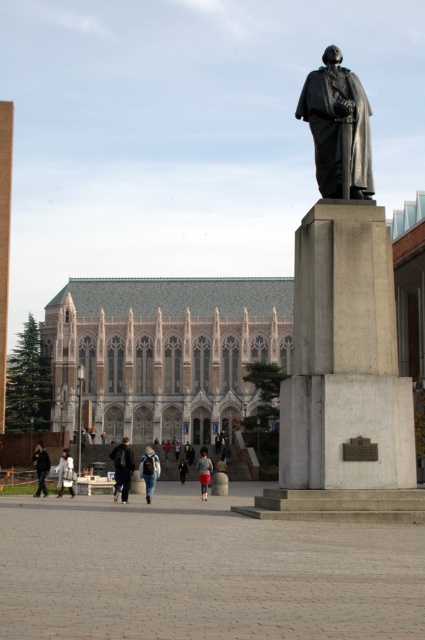
Question: Observing the image, what is the correct spatial positioning of dark gray jacket at lower left in reference to light gray fabric jacket at lower left?

Choices:
 (A) below
 (B) above

Answer: (B)

Question: Among these points, which one is farthest from the camera?

Choices:
 (A) (39, 452)
 (B) (368, 154)
 (C) (204, 460)
 (D) (153, 465)

Answer: (C)

Question: Which point is closer to the camera?

Choices:
 (A) polished bronze statue at center
 (B) matte black statue at center

Answer: (A)

Question: Is polished bronze statue at center smaller than denim jacket at center?

Choices:
 (A) no
 (B) yes

Answer: (A)

Question: Estimate the real-world distances between objects in this image. Which object is closer to the matte black statue at center?

Choices:
 (A) denim jacket at center
 (B) dark gray jacket at lower left
 (C) dark gray jacket at center
 (D) gray fabric pants at center

Answer: (A)

Question: Can you confirm if dark blue jeans at center is smaller than dark gray jacket at lower left?

Choices:
 (A) yes
 (B) no

Answer: (B)